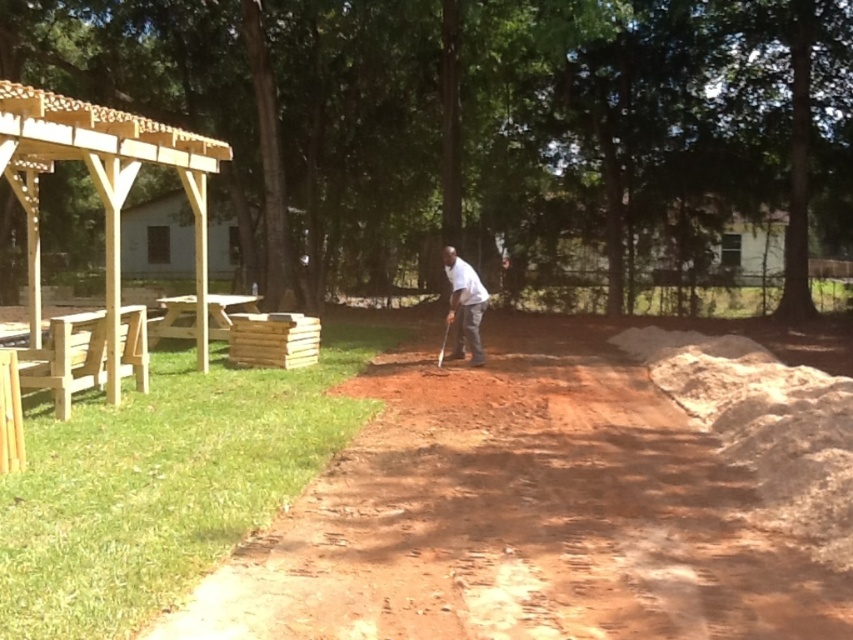
You are planning to set up a small tent in the brown dirt field at center. However, there is a brown wooden picnic table at left nearby. Based on the scene, can you determine if the picnic table is above or below the dirt field?

The brown dirt field at center is located below the brown wooden picnic table at left, so the picnic table is above the dirt field.

In the scene shown: You are standing at the entrance of the park and want to go to the brown wooden picnic table at left. Which direction should you walk to avoid passing through the natural wood pergola at upper left?

To reach the brown wooden picnic table at left without passing through the natural wood pergola at upper left, you should walk around to the side of the natural wood pergola at upper left since it is in front of the picnic table. Alternatively, you can go behind the natural wood pergola at upper left as it is blocking the direct path to the picnic table.